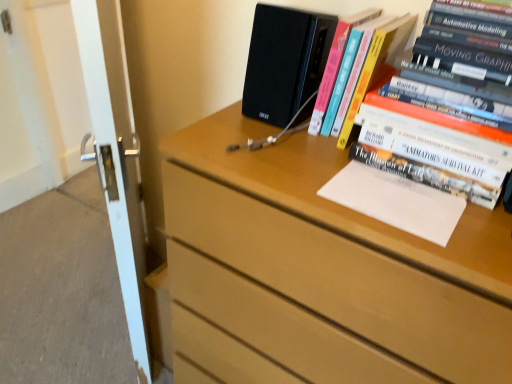
Find the location of a particular element. free location to the left of hardcover books at upper right, positioned as the 2th book in left-to-right order is located at coordinates 287,157.